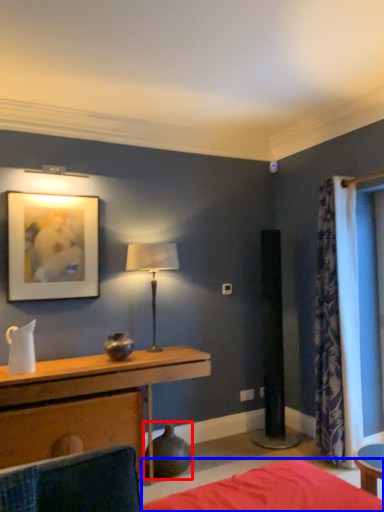
Question: Which object appears closest to the camera in this image, vase (highlighted by a red box) or bed frame (highlighted by a blue box)?

Choices:
 (A) vase
 (B) bed frame

Answer: (B)